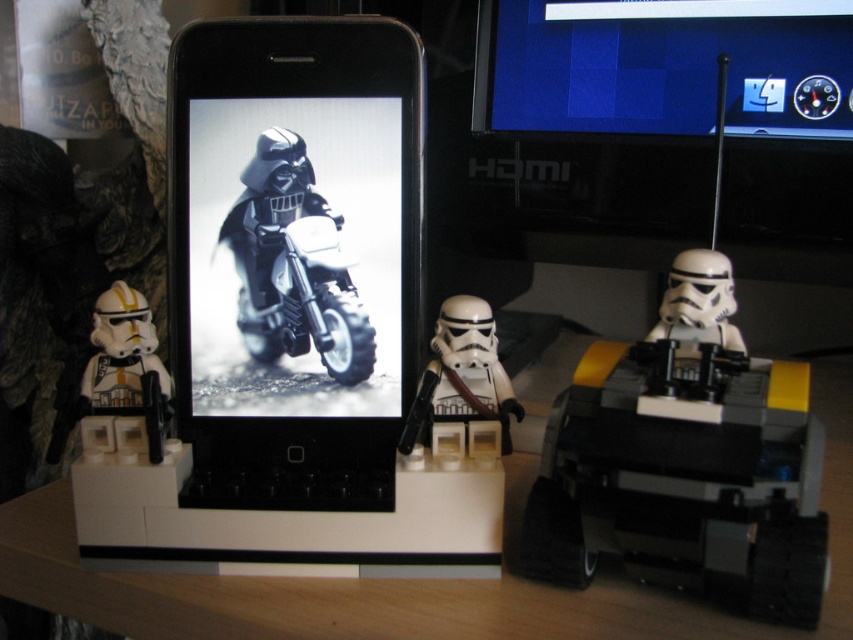
From the picture: You are a LEGO figure collector who wants to place a new LEGO figure exactly at the center of the wooden surface. The wooden surface has a coordinate system where the bottom left corner is the origin point. The white matte stormtrooper at left is currently at position point 0.572, 0.150. What coordinate should you use to place the new LEGO figure at the center?

The center of the wooden surface would be at coordinate point (426, 320). Since the white matte stormtrooper at left is at (126, 365), the center is slightly to the left and above the stormtrooper. Therefore, you should place the new LEGO figure at coordinate point (426, 320) to center it on the wooden surface.

You are a LEGO enthusiast trying to build a display. You have a matte black motorcycle at center and a white plastic stormtrooper at center. Which object takes up more space in the display?

The white plastic stormtrooper at center takes up more space in the display because it is larger than the matte black motorcycle at center.

From the picture: You are a LEGO designer who needs to fit a matte black motorcycle at center and a white plastic stormtrooper at center into a display case that is 4 inches wide. Can both items fit side by side without overlapping?

The matte black motorcycle at center is 3.90 inches away from the white plastic stormtrooper at center. Since the distance between them is less than the 4 inches width of the display case, both items can fit side by side without overlapping.